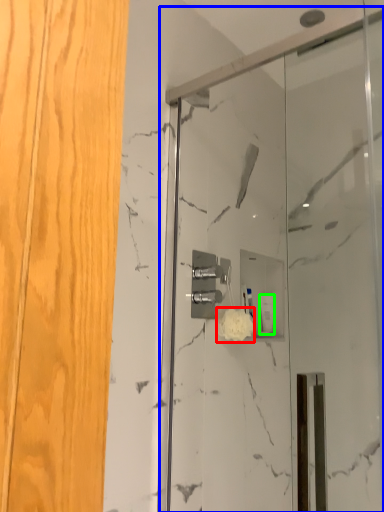
Question: Considering the real-world distances, which object is farthest from flower (highlighted by a red box)? screen door (highlighted by a blue box) or toiletry (highlighted by a green box)?

Choices:
 (A) screen door
 (B) toiletry

Answer: (A)